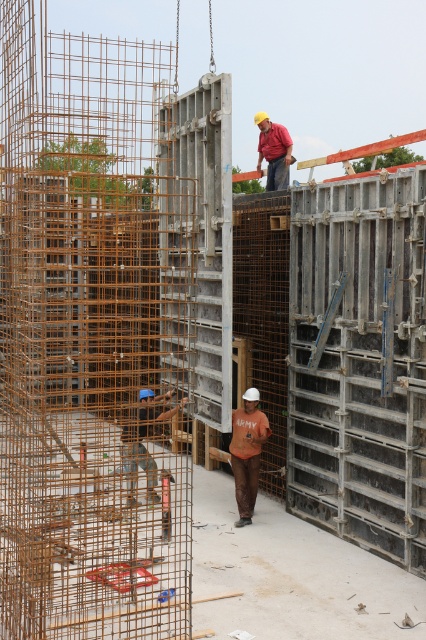
Question: Is blue hard hat at center in front of red fabric shirt at upper center?

Choices:
 (A) no
 (B) yes

Answer: (B)

Question: Which point is closer to the camera?

Choices:
 (A) red fabric shirt at upper center
 (B) orange cotton shirt at center
 (C) blue hard hat at center

Answer: (C)

Question: Which point is closer to the camera?

Choices:
 (A) orange cotton shirt at center
 (B) blue hard hat at center

Answer: (B)

Question: Observing the image, what is the correct spatial positioning of orange cotton shirt at center in reference to red fabric shirt at upper center?

Choices:
 (A) above
 (B) below

Answer: (B)

Question: Which of the following is the farthest from the observer?

Choices:
 (A) (256, 396)
 (B) (256, 120)
 (C) (149, 500)

Answer: (B)

Question: Does blue hard hat at center lie behind orange cotton shirt at center?

Choices:
 (A) no
 (B) yes

Answer: (A)